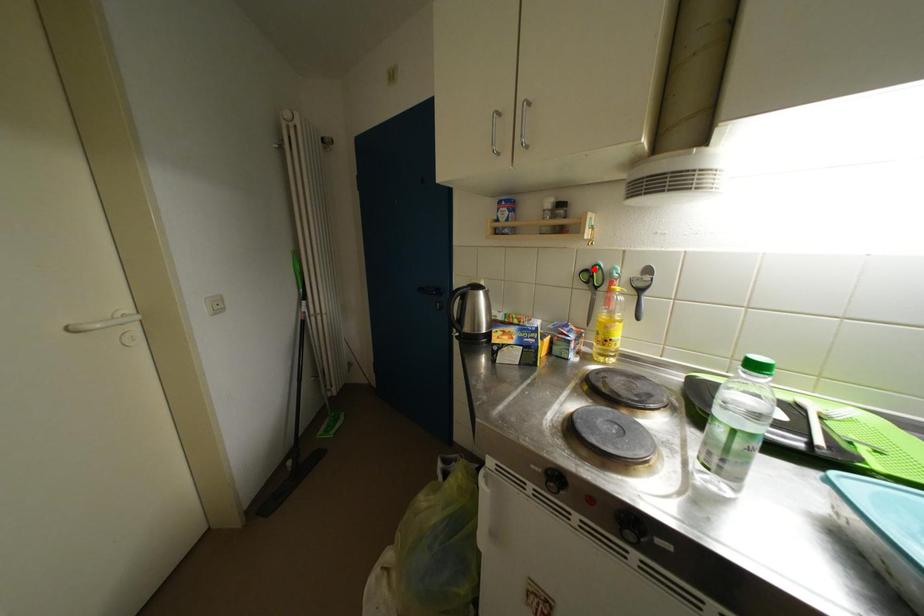
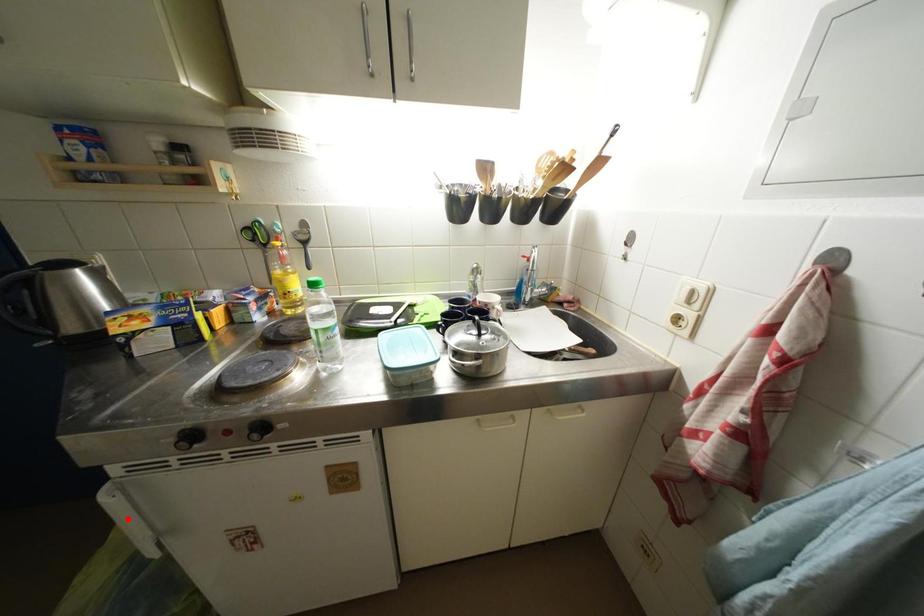
I am providing you with two images of the same scene from different viewpoints. A red point is marked on the first image and another point is marked on the second image. Are the points marked in image1 and image2 representing the same 3D position?

No